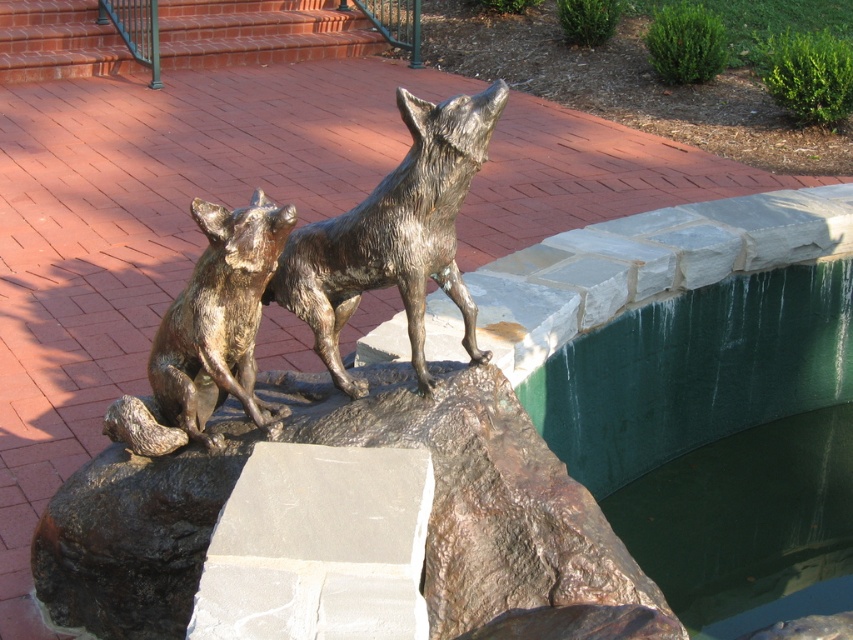
Who is positioned more to the right, green concrete water at upper right or bronze/statue at center?

green concrete water at upper right is more to the right.

Can you confirm if green concrete water at upper right is positioned above bronze/statue at center?

No, green concrete water at upper right is not above bronze/statue at center.

Is point (827, 588) positioned before point (413, 298)?

That is False.

Find the location of a particular element. The height and width of the screenshot is (640, 853). green concrete water at upper right is located at coordinates tap(717, 440).

Does point (412, 332) come behind point (117, 413)?

No, (412, 332) is in front of (117, 413).

Identify the location of bronze/statue at center. (393, 234).

How distant is green concrete water at upper right from bronze statue of dog at center?

They are 6.23 feet apart.

Does green concrete water at upper right have a greater height compared to bronze statue of dog at center?

Correct, green concrete water at upper right is much taller as bronze statue of dog at center.

Locate an element on the screen. The image size is (853, 640). green concrete water at upper right is located at coordinates (717, 440).

Find the location of a particular element. This screenshot has height=640, width=853. green concrete water at upper right is located at coordinates (717, 440).